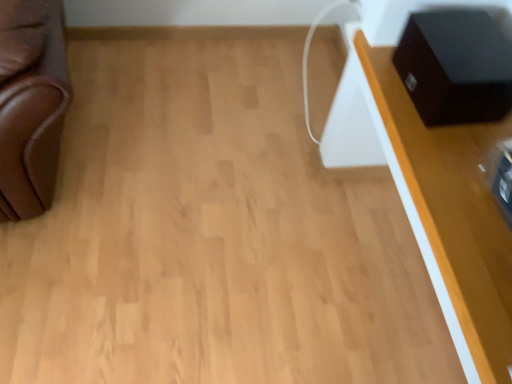
What is the approximate height of white glossy table at upper right?

The height of white glossy table at upper right is 36.02 inches.

Find the location of a particular element. This screenshot has width=512, height=384. white glossy table at upper right is located at coordinates (451, 216).

Image resolution: width=512 pixels, height=384 pixels. What do you see at coordinates (451, 216) in the screenshot?
I see `white glossy table at upper right` at bounding box center [451, 216].

In order to face white glossy table at upper right, should I rotate leftwards or rightwards?

A 25.733 degree turn to the right will do.

What do you see at coordinates (455, 67) in the screenshot? I see `black matte speaker at upper right` at bounding box center [455, 67].

Where is `black matte speaker at upper right`? This screenshot has height=384, width=512. black matte speaker at upper right is located at coordinates (455, 67).

I want to click on white glossy table at upper right, so click(x=451, y=216).

Which is more to the left, white glossy table at upper right or black matte speaker at upper right?

From the viewer's perspective, black matte speaker at upper right appears more on the left side.

Does white glossy table at upper right lie behind black matte speaker at upper right?

No, it is not.

Is point (401, 197) farther from viewer compared to point (415, 34)?

Yes, point (401, 197) is farther from viewer.

From the image's perspective, is white glossy table at upper right located beneath black matte speaker at upper right?

Indeed, from the image's perspective, white glossy table at upper right is shown beneath black matte speaker at upper right.

From a real-world perspective, does white glossy table at upper right stand above black matte speaker at upper right?

Actually, white glossy table at upper right is physically below black matte speaker at upper right in the real world.

Is white glossy table at upper right thinner than black matte speaker at upper right?

In fact, white glossy table at upper right might be wider than black matte speaker at upper right.

From their relative heights in the image, would you say white glossy table at upper right is taller or shorter than black matte speaker at upper right?

In the image, white glossy table at upper right appears to be taller than black matte speaker at upper right.

Does white glossy table at upper right have a smaller size compared to black matte speaker at upper right?

No.

Is black matte speaker at upper right inside white glossy table at upper right?

That's correct, black matte speaker at upper right is inside white glossy table at upper right.

Is white glossy table at upper right placed right next to black matte speaker at upper right?

No, white glossy table at upper right is not next to black matte speaker at upper right.

Is white glossy table at upper right facing towards black matte speaker at upper right?

Yes, white glossy table at upper right is facing black matte speaker at upper right.

How different are the orientations of white glossy table at upper right and black matte speaker at upper right in degrees?

2.54 degrees separate the facing orientations of white glossy table at upper right and black matte speaker at upper right.

There is a white glossy table at upper right. In order to click on speaker above it (from a real-world perspective) in this screenshot , I will do `click(455, 67)`.

Based on the photo, visually, is black matte speaker at upper right positioned to the left or to the right of white glossy table at upper right?

black matte speaker at upper right is to the left of white glossy table at upper right.

Considering the positions of objects black matte speaker at upper right and white glossy table at upper right in the image provided, who is behind, black matte speaker at upper right or white glossy table at upper right?

black matte speaker at upper right is more distant.

Considering the positions of points (505, 92) and (446, 134), is point (505, 92) closer to camera compared to point (446, 134)?

Yes, it is.

Consider the image. From the image's perspective, is black matte speaker at upper right above or below white glossy table at upper right?

black matte speaker at upper right is situated higher than white glossy table at upper right in the image.

From a real-world perspective, relative to white glossy table at upper right, is black matte speaker at upper right vertically above or below?

black matte speaker at upper right is above white glossy table at upper right.

Is black matte speaker at upper right thinner than white glossy table at upper right?

Indeed, black matte speaker at upper right has a lesser width compared to white glossy table at upper right.

Does black matte speaker at upper right have a greater height compared to white glossy table at upper right?

Incorrect, the height of black matte speaker at upper right is not larger of that of white glossy table at upper right.

Considering the relative sizes of black matte speaker at upper right and white glossy table at upper right in the image provided, is black matte speaker at upper right smaller than white glossy table at upper right?

Correct, black matte speaker at upper right occupies less space than white glossy table at upper right.

Based on the photo, would you say black matte speaker at upper right is outside white glossy table at upper right?

Actually, black matte speaker at upper right is at least partially inside white glossy table at upper right.

Is black matte speaker at upper right far from white glossy table at upper right?

Actually, black matte speaker at upper right and white glossy table at upper right are a little close together.

Is black matte speaker at upper right aimed at white glossy table at upper right?

Yes, black matte speaker at upper right is facing white glossy table at upper right.

What's the angular difference between black matte speaker at upper right and white glossy table at upper right's facing directions?

2.54 degrees.

Where is `speaker located above the white glossy table at upper right (from the image's perspective)`? The height and width of the screenshot is (384, 512). speaker located above the white glossy table at upper right (from the image's perspective) is located at coordinates (455, 67).

Where is `table that appears below the black matte speaker at upper right (from a real-world perspective)`? table that appears below the black matte speaker at upper right (from a real-world perspective) is located at coordinates (451, 216).

The image size is (512, 384). In order to click on table to the right of black matte speaker at upper right in this screenshot , I will do click(451, 216).